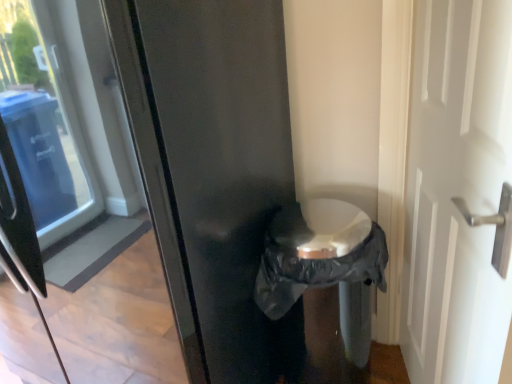
Question: Does black plastic bag at center have a smaller size compared to white glossy door at right?

Choices:
 (A) no
 (B) yes

Answer: (A)

Question: Is black plastic bag at center shorter than white glossy door at right?

Choices:
 (A) yes
 (B) no

Answer: (A)

Question: Is black plastic bag at center completely or partially outside of white glossy door at right?

Choices:
 (A) yes
 (B) no

Answer: (A)

Question: From a real-world perspective, is black plastic bag at center over white glossy door at right?

Choices:
 (A) yes
 (B) no

Answer: (B)

Question: Does black plastic bag at center have a greater width compared to white glossy door at right?

Choices:
 (A) yes
 (B) no

Answer: (A)

Question: Considering the positions of matte black refrigerator at center and black plastic bag at center in the image, is matte black refrigerator at center taller or shorter than black plastic bag at center?

Choices:
 (A) tall
 (B) short

Answer: (A)

Question: Considering the relative positions of matte black refrigerator at center and black plastic bag at center in the image provided, is matte black refrigerator at center to the left or to the right of black plastic bag at center?

Choices:
 (A) left
 (B) right

Answer: (A)

Question: Is matte black refrigerator at center bigger or smaller than black plastic bag at center?

Choices:
 (A) big
 (B) small

Answer: (A)

Question: Is matte black refrigerator at center spatially inside black plastic bag at center, or outside of it?

Choices:
 (A) outside
 (B) inside

Answer: (A)

Question: From the image's perspective, relative to white glossy door at right, is black plastic bag at center above or below?

Choices:
 (A) above
 (B) below

Answer: (B)

Question: Considering the positions of black plastic bag at center and white glossy door at right in the image, is black plastic bag at center taller or shorter than white glossy door at right?

Choices:
 (A) tall
 (B) short

Answer: (B)

Question: Considering the positions of point (291, 226) and point (435, 236), is point (291, 226) closer or farther from the camera than point (435, 236)?

Choices:
 (A) closer
 (B) farther

Answer: (B)

Question: Is black plastic bag at center bigger or smaller than white glossy door at right?

Choices:
 (A) big
 (B) small

Answer: (A)

Question: From a real-world perspective, is white glossy door at right above or below matte black refrigerator at center?

Choices:
 (A) below
 (B) above

Answer: (A)

Question: Would you say white glossy door at right is inside or outside matte black refrigerator at center?

Choices:
 (A) inside
 (B) outside

Answer: (B)